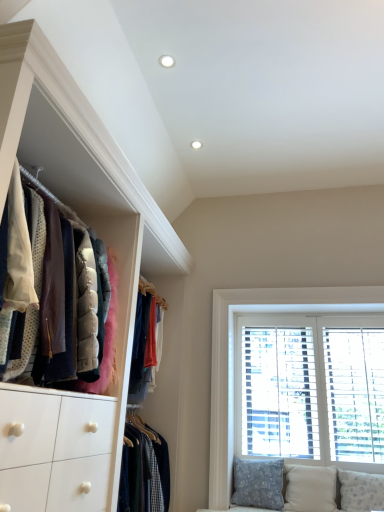
Question: Is the depth of white textured pillow at lower right, the first pillow positioned from the right, less than that of beige fabric pillow at lower right, the 2th pillow viewed from the right?

Choices:
 (A) no
 (B) yes

Answer: (B)

Question: Is white textured pillow at lower right, acting as the third pillow starting from the left, beside beige fabric pillow at lower right, the second pillow when ordered from left to right?

Choices:
 (A) yes
 (B) no

Answer: (B)

Question: Does white textured pillow at lower right, acting as the third pillow starting from the left, have a smaller size compared to beige fabric pillow at lower right, the second pillow when ordered from left to right?

Choices:
 (A) yes
 (B) no

Answer: (B)

Question: From a real-world perspective, is white textured pillow at lower right, the first pillow positioned from the right, physically above beige fabric pillow at lower right, the 2th pillow viewed from the right?

Choices:
 (A) no
 (B) yes

Answer: (B)

Question: Does white textured pillow at lower right, the first pillow positioned from the right, have a greater width compared to beige fabric pillow at lower right, the 2th pillow viewed from the right?

Choices:
 (A) no
 (B) yes

Answer: (B)

Question: Does white textured pillow at lower right, acting as the third pillow starting from the left, have a lesser height compared to beige fabric pillow at lower right, the second pillow when ordered from left to right?

Choices:
 (A) no
 (B) yes

Answer: (B)

Question: Is velvet jackets at left beside white wood window at right?

Choices:
 (A) yes
 (B) no

Answer: (B)

Question: From a real-world perspective, is velvet jackets at left physically below white wood window at right?

Choices:
 (A) no
 (B) yes

Answer: (A)

Question: Could you tell me if velvet jackets at left is facing white wood window at right?

Choices:
 (A) no
 (B) yes

Answer: (A)

Question: Considering the relative sizes of velvet jackets at left and white wood window at right in the image provided, is velvet jackets at left taller than white wood window at right?

Choices:
 (A) yes
 (B) no

Answer: (B)

Question: Can you confirm if velvet jackets at left is bigger than white wood window at right?

Choices:
 (A) yes
 (B) no

Answer: (A)

Question: Can you confirm if velvet jackets at left is thinner than white wood window at right?

Choices:
 (A) yes
 (B) no

Answer: (B)

Question: Is velvet jackets at left not close to patterned fabric pillow at lower right, the 1th pillow in the left-to-right sequence?

Choices:
 (A) yes
 (B) no

Answer: (A)